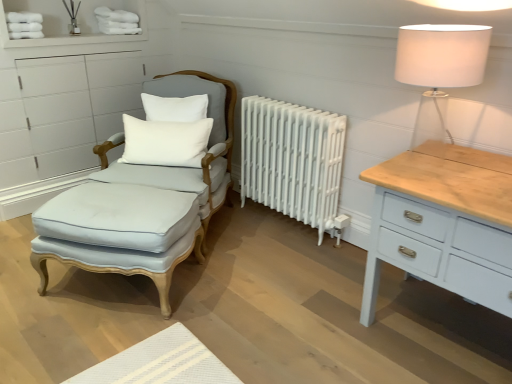
Find the location of a particular element. This screenshot has width=512, height=384. vacant location below light blue fabric footrest at left (from a real-world perspective) is located at coordinates (125, 284).